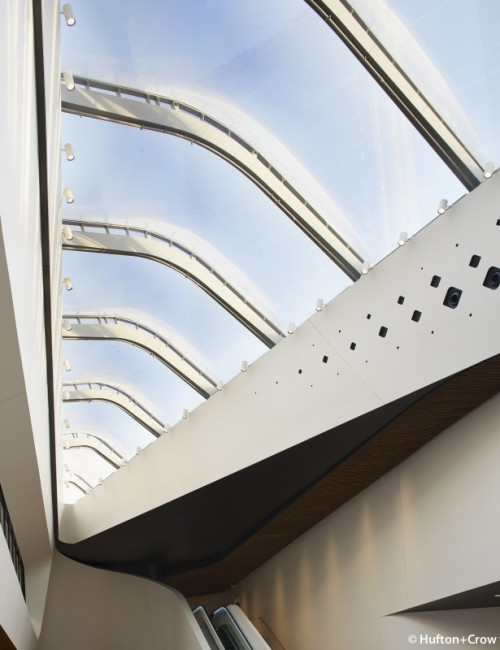
Image resolution: width=500 pixels, height=650 pixels. In order to click on wall in this screenshot , I will do `click(422, 541)`, `click(101, 593)`.